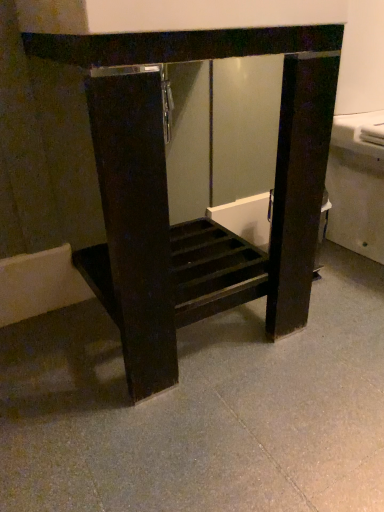
Locate an element on the screen. free location to the right of matte black cabinet at center is located at coordinates (335, 326).